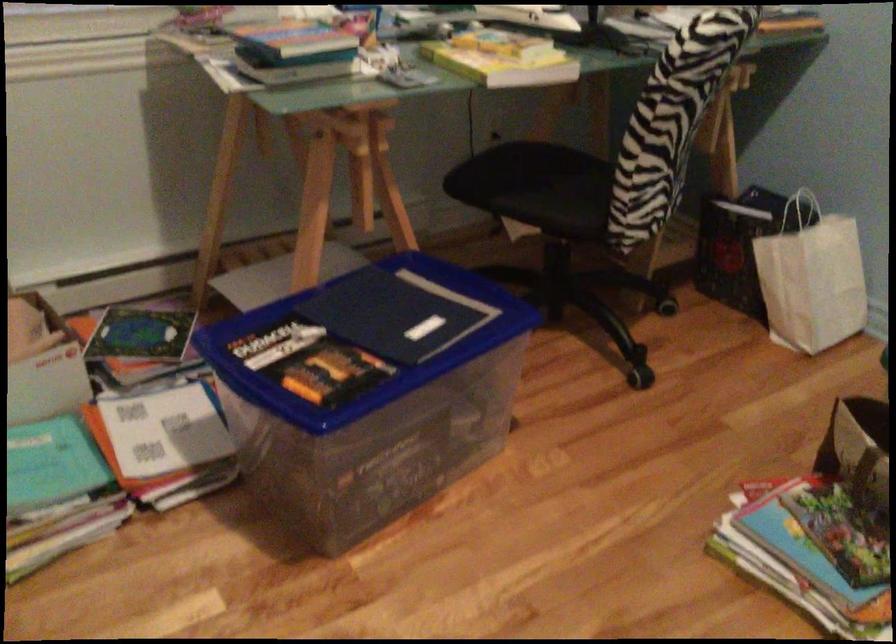
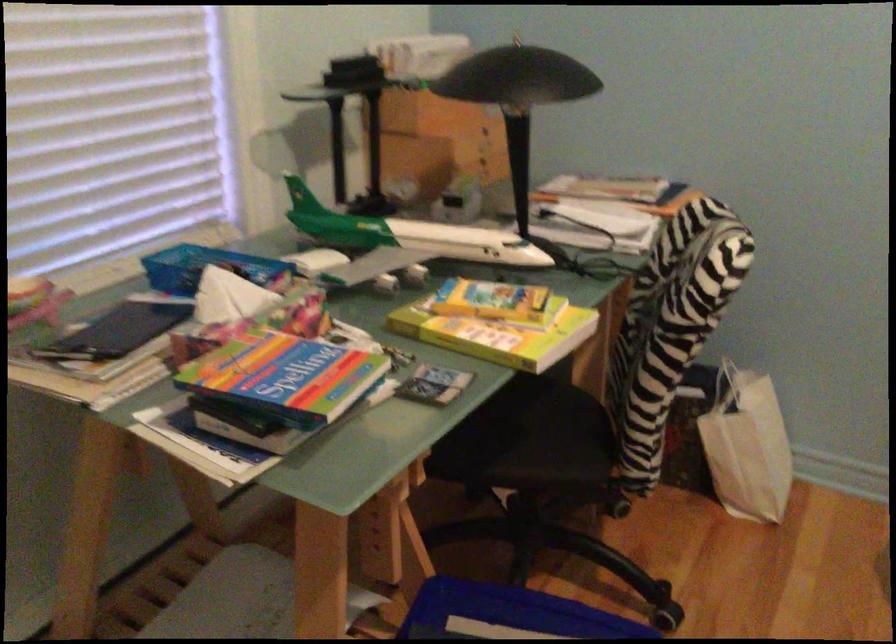
Find the pixel in the second image that matches pixel 533 182 in the first image.

(510, 430)